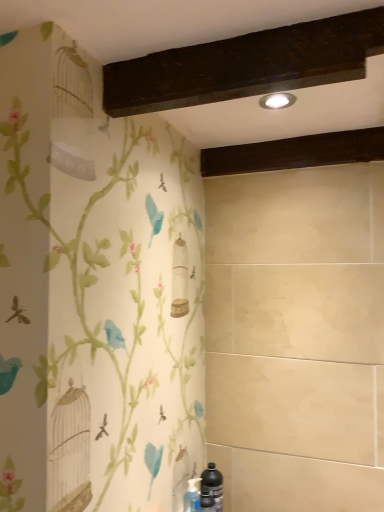
This screenshot has width=384, height=512. I want to click on matte silver light fixture at upper center, so click(x=277, y=101).

The image size is (384, 512). I want to click on dark wood beam at upper center, so click(295, 152).

Locate an element on the screen. This screenshot has width=384, height=512. black matte bottle at lower right is located at coordinates (213, 485).

From the image's perspective, is black matte bottle at lower right located above or below matte silver light fixture at upper center?

black matte bottle at lower right is situated lower than matte silver light fixture at upper center in the image.

Is point (217, 498) farther from camera compared to point (282, 96)?

Yes, it is.

From a real-world perspective, between black matte bottle at lower right and matte silver light fixture at upper center, who is vertically lower?

From a 3D spatial view, black matte bottle at lower right is below.

Does point (203, 490) come behind point (280, 141)?

No, (203, 490) is in front of (280, 141).

Is black matte bottle at lower right in front of or behind dark wood beam at upper center in the image?

In the image, black matte bottle at lower right appears in front of dark wood beam at upper center.

Considering the relative sizes of black matte bottle at lower right and dark wood beam at upper center in the image provided, is black matte bottle at lower right bigger than dark wood beam at upper center?

Incorrect, black matte bottle at lower right is not larger than dark wood beam at upper center.

Locate an element on the screen. This screenshot has height=512, width=384. bottle located underneath the dark wood beam at upper center (from a real-world perspective) is located at coordinates (213, 485).

Is matte silver light fixture at upper center wider or thinner than black matte bottle at lower right?

matte silver light fixture at upper center is wider than black matte bottle at lower right.

Considering the positions of points (287, 106) and (217, 478), is point (287, 106) farther from camera compared to point (217, 478)?

No, (287, 106) is in front of (217, 478).

Considering the relative positions of matte silver light fixture at upper center and black matte bottle at lower right in the image provided, is matte silver light fixture at upper center in front of black matte bottle at lower right?

Yes, it is.

Is dark wood beam at upper center thinner than black matte bottle at lower right?

No, dark wood beam at upper center is not thinner than black matte bottle at lower right.

How many degrees apart are the facing directions of dark wood beam at upper center and black matte bottle at lower right?

They differ by 180 degrees in their facing directions.

Is point (360, 160) closer or farther from the camera than point (204, 484)?

Point (360, 160) appears to be closer to the viewer than point (204, 484).

The height and width of the screenshot is (512, 384). There is a black matte bottle at lower right. Identify the location of plank above it (from a real-world perspective). (295, 152).

Image resolution: width=384 pixels, height=512 pixels. In order to click on light fixture above the dark wood beam at upper center (from a real-world perspective) in this screenshot , I will do `click(277, 101)`.

Are dark wood beam at upper center and matte silver light fixture at upper center beside each other?

No, dark wood beam at upper center is not next to matte silver light fixture at upper center.

From a real-world perspective, is dark wood beam at upper center above or below matte silver light fixture at upper center?

Clearly, from a real-world perspective, dark wood beam at upper center is below matte silver light fixture at upper center.

Consider the image. Considering the relative positions of dark wood beam at upper center and matte silver light fixture at upper center in the image provided, is dark wood beam at upper center to the left or to the right of matte silver light fixture at upper center?

dark wood beam at upper center is positioned on matte silver light fixture at upper center's right side.

From a real-world perspective, between matte silver light fixture at upper center and dark wood beam at upper center, who is vertically lower?

dark wood beam at upper center, from a real-world perspective.

The height and width of the screenshot is (512, 384). What are the coordinates of `light fixture above the dark wood beam at upper center (from the image's perspective)` in the screenshot? It's located at (277, 101).

Looking at their sizes, would you say matte silver light fixture at upper center is wider or thinner than dark wood beam at upper center?

matte silver light fixture at upper center is thinner than dark wood beam at upper center.

Is matte silver light fixture at upper center bigger than dark wood beam at upper center?

Incorrect, matte silver light fixture at upper center is not larger than dark wood beam at upper center.

I want to click on bottle behind the matte silver light fixture at upper center, so click(x=213, y=485).

Where is `plank that appears above the black matte bottle at lower right (from a real-world perspective)`? The width and height of the screenshot is (384, 512). plank that appears above the black matte bottle at lower right (from a real-world perspective) is located at coordinates (295, 152).

Looking at the image, which one is located further to dark wood beam at upper center, black matte bottle at lower right or matte silver light fixture at upper center?

The object further to dark wood beam at upper center is black matte bottle at lower right.

From the image, which object appears to be farther from black matte bottle at lower right, dark wood beam at upper center or matte silver light fixture at upper center?

Among the two, matte silver light fixture at upper center is located further to black matte bottle at lower right.

When comparing their distances from dark wood beam at upper center, does matte silver light fixture at upper center or black matte bottle at lower right seem closer?

matte silver light fixture at upper center.

Estimate the real-world distances between objects in this image. Which object is closer to black matte bottle at lower right, matte silver light fixture at upper center or dark wood beam at upper center?

dark wood beam at upper center lies closer to black matte bottle at lower right than the other object.

Which object lies further to the anchor point matte silver light fixture at upper center, dark wood beam at upper center or black matte bottle at lower right?

black matte bottle at lower right is further to matte silver light fixture at upper center.

When comparing their distances from matte silver light fixture at upper center, does black matte bottle at lower right or dark wood beam at upper center seem further?

Among the two, black matte bottle at lower right is located further to matte silver light fixture at upper center.

Identify the location of plank that lies between matte silver light fixture at upper center and black matte bottle at lower right from top to bottom. The width and height of the screenshot is (384, 512). [295, 152].